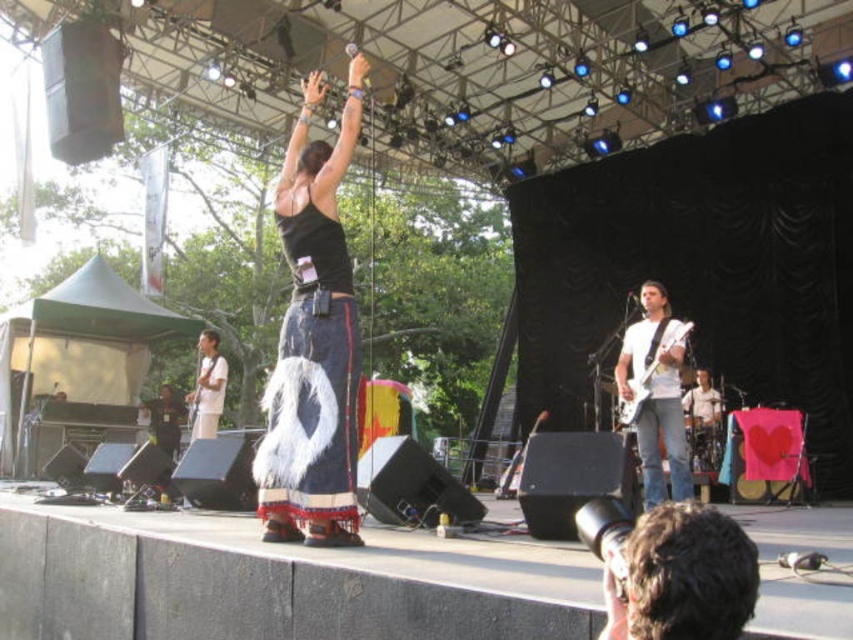
Question: Which object is positioned farthest from the white matte guitar at center?

Choices:
 (A) dark brown hair at lower right
 (B) white glossy electric guitar at center right
 (C) black denim skirt at center

Answer: (A)

Question: Which object is the farthest from the white glossy electric guitar at center right?

Choices:
 (A) black denim skirt at center
 (B) white matte guitar at center

Answer: (A)

Question: Among these objects, which one is nearest to the camera?

Choices:
 (A) white glossy electric guitar at center right
 (B) white matte guitar at center

Answer: (B)

Question: Considering the relative positions of white matte guitar at center and white glossy electric guitar at center right in the image provided, where is white matte guitar at center located with respect to white glossy electric guitar at center right?

Choices:
 (A) right
 (B) left

Answer: (A)

Question: Is black denim skirt at center above white matte guitar at center?

Choices:
 (A) yes
 (B) no

Answer: (A)

Question: Can you confirm if white matte guitar at center is wider than white glossy electric guitar at center right?

Choices:
 (A) yes
 (B) no

Answer: (A)